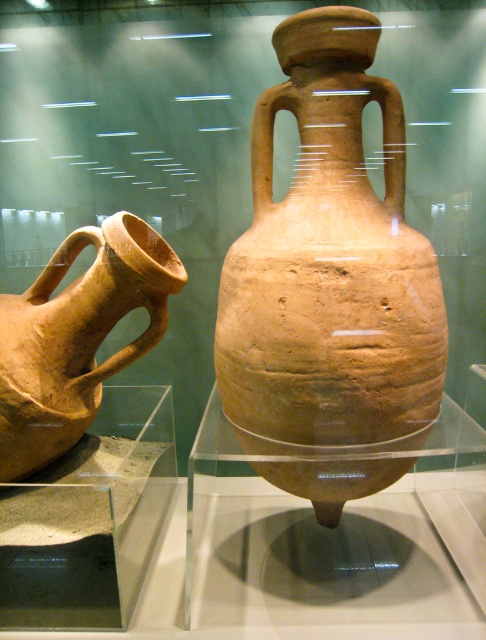
Can you confirm if brown matte amphora at center is positioned to the left of matte clay jug at left?

No, brown matte amphora at center is not to the left of matte clay jug at left.

Between point (315, 129) and point (2, 426), which one is positioned behind?

Positioned behind is point (2, 426).

Which is behind, point (369, 285) or point (110, 259)?

The point (110, 259) is more distant.

Find the location of a particular element. brown matte amphora at center is located at coordinates (329, 266).